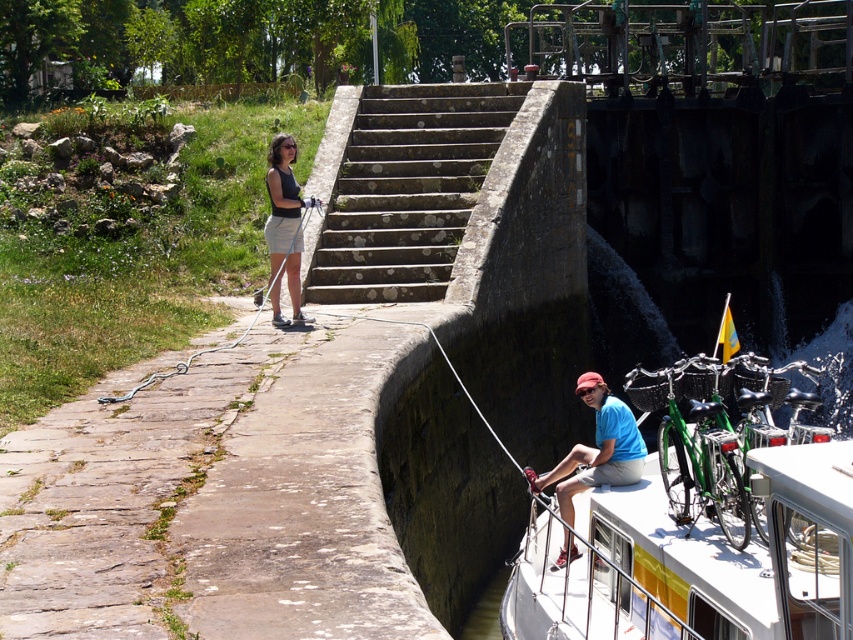
You are standing on the pathway and want to greet the person wearing the blue cotton shirt at upper right. Which direction should you walk to reach them from the matte black tank top at center?

The blue cotton shirt at upper right is to the right of the matte black tank top at center, so you should walk to the right to reach them.

You are a visitor at the lock system and want to take a photo of the matte black tank top at center and the white rubber rope at left. Which object should you focus on first if you want to capture both in the frame without moving the camera?

You should focus on the matte black tank top at center first because it is positioned to the left of the white rubber rope at left, so capturing it first ensures both objects are within the frame without needing to adjust the camera position.